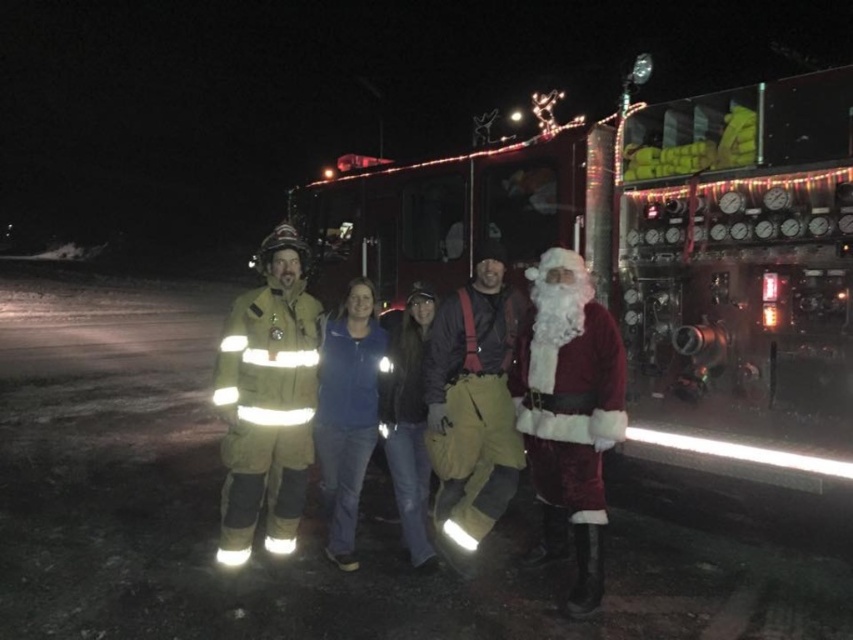
You are a photographer trying to capture a photo of the red reflective fire truck at center and the velvet red santa at right. From the perspective of someone standing in front of the group, which object is located to the left of the other?

The red reflective fire truck at center is positioned on the left side of velvet red santa at right.

You are a photographer standing 2 meters away from the red reflective fire truck at center. You want to take a photo of the velvet red santa at right without the fire truck blocking the view. Is the distance between them sufficient for you to move closer to the santa and still capture him without the fire truck obstructing the shot?

The distance between the red reflective fire truck at center and the velvet red santa at right is 1.49 meters. Since you are 2 meters away from the fire truck, moving closer to the santa would require moving within 1.49 meters from the fire truck. However, since the total distance from you to the fire truck is 2 meters, you can move 0.51 meters towards the santa, keeping 1.49 meters between you and the fire truck, but this might not be enough space to avoid obstruction. Alternatively, moving around the fire

You are a photographer trying to capture a clear photo of both the velvet red santa at right and the fuzzy white beard at center. Since the camera can only focus on one object at a time, which object should you choose to ensure it appears sharp and in focus, considering their sizes?

The velvet red santa at right is thinner than the fuzzy white beard at center, so focusing on the fuzzy white beard at center would be better because larger objects are easier to capture in focus.